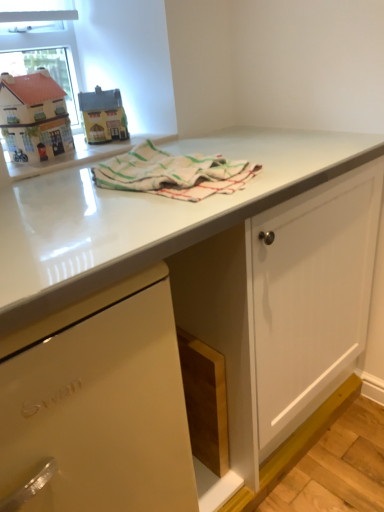
Question: From the image's perspective, does matte plastic toy house at upper left appear lower than clear glass window screen at upper left?

Choices:
 (A) no
 (B) yes

Answer: (B)

Question: Does matte plastic toy house at upper left touch clear glass window screen at upper left?

Choices:
 (A) yes
 (B) no

Answer: (B)

Question: From a real-world perspective, is matte plastic toy house at upper left on clear glass window screen at upper left?

Choices:
 (A) no
 (B) yes

Answer: (A)

Question: Does matte plastic toy house at upper left have a lesser width compared to clear glass window screen at upper left?

Choices:
 (A) yes
 (B) no

Answer: (B)

Question: From a real-world perspective, is matte plastic toy house at upper left under clear glass window screen at upper left?

Choices:
 (A) yes
 (B) no

Answer: (A)

Question: Considering the relative sizes of matte plastic toy house at upper left and clear glass window screen at upper left in the image provided, is matte plastic toy house at upper left wider than clear glass window screen at upper left?

Choices:
 (A) yes
 (B) no

Answer: (A)

Question: Can you confirm if white striped cloth at center is thinner than matte white dishwasher at lower left?

Choices:
 (A) no
 (B) yes

Answer: (B)

Question: Is white striped cloth at center completely or partially outside of matte white dishwasher at lower left?

Choices:
 (A) yes
 (B) no

Answer: (A)

Question: Does white striped cloth at center have a lesser height compared to matte white dishwasher at lower left?

Choices:
 (A) yes
 (B) no

Answer: (A)

Question: Is white striped cloth at center oriented towards matte white dishwasher at lower left?

Choices:
 (A) no
 (B) yes

Answer: (A)

Question: Would you say matte white dishwasher at lower left is part of white striped cloth at center's contents?

Choices:
 (A) yes
 (B) no

Answer: (B)

Question: Considering the relative positions of white striped cloth at center and matte white dishwasher at lower left in the image provided, is white striped cloth at center in front of matte white dishwasher at lower left?

Choices:
 (A) no
 (B) yes

Answer: (A)

Question: Is there a large distance between matte plastic toy house at upper left and matte white dishwasher at lower left?

Choices:
 (A) yes
 (B) no

Answer: (B)